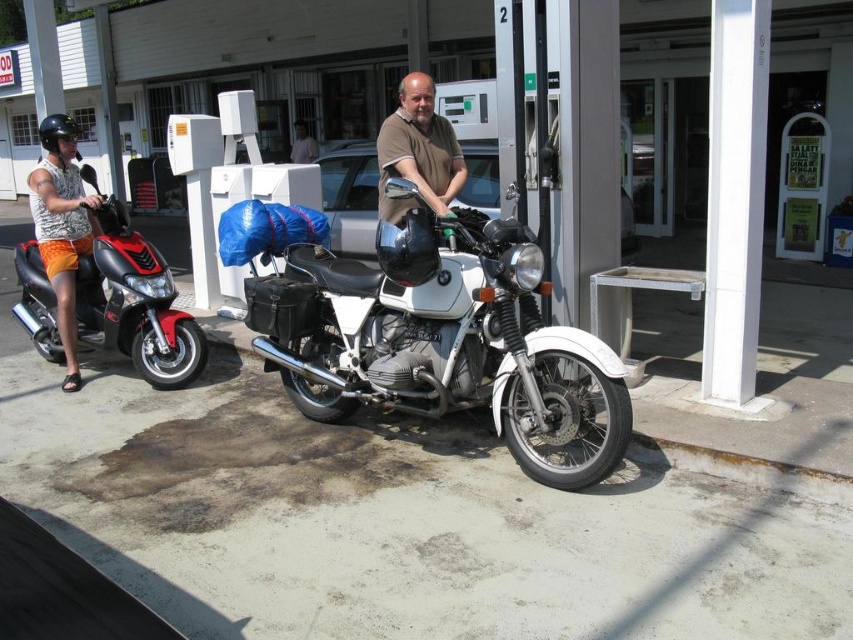
You are a photographer standing at the back of the gas station. You want to take a photo of the white matte motorcycle at center and the light pink fabric shirt at center. Which object should you focus on first if you want to capture both in the frame without moving your camera?

The white matte motorcycle at center is taller than the light pink fabric shirt at center, so you should focus on the white matte motorcycle at center first to ensure it fits within the frame.

You are a delivery person who needs to place a 30 feet long package between the white matte motorcycle at center and the light pink fabric shirt at center. Is there enough space between them to fit the package?

The white matte motorcycle at center and the light pink fabric shirt at center are 33.38 feet apart from each other, so yes, the 30 feet long package can fit between them since the distance is greater than the package length.